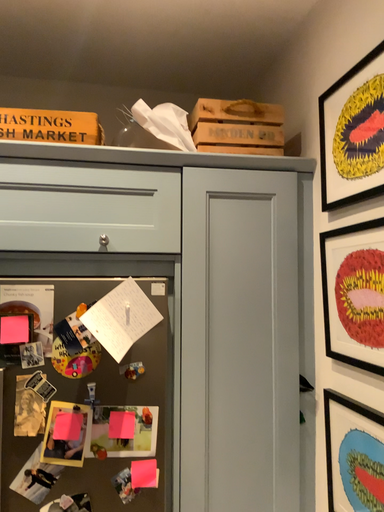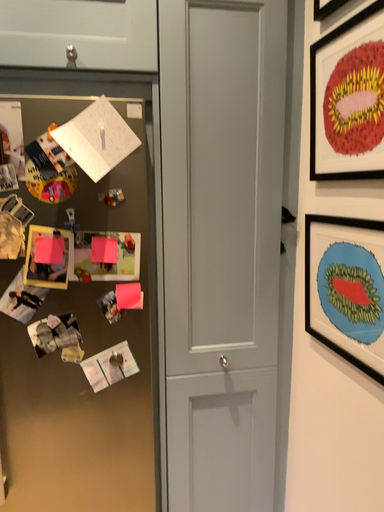
Question: Which way did the camera rotate in the video?

Choices:
 (A) rotated upward
 (B) rotated downward

Answer: (B)